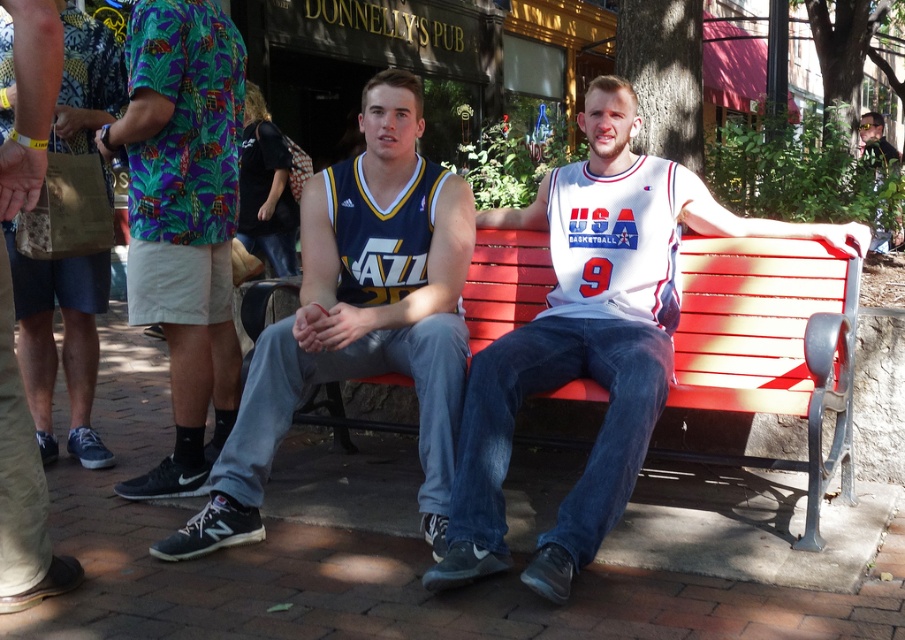
You are a photographer setting up a tripod to take a group photo of the two people on the red bench. The printed fabric shirt at left and the khaki shorts at center are part of their outfits. Which clothing item should you focus on first if you want to ensure both are in focus, considering their vertical positions?

The printed fabric shirt at left is taller than the khaki shorts at center, so focusing on the printed fabric shirt at left will ensure both are in focus as it is higher up.

You are a photographer trying to capture a candid shot of both the blue jersey at center and the matte black tank top at upper right. Which subject should you focus on first to ensure both are in frame?

The blue jersey at center is below matte black tank top at upper right, so focus on the matte black tank top at upper right first to ensure both are within the camera frame.